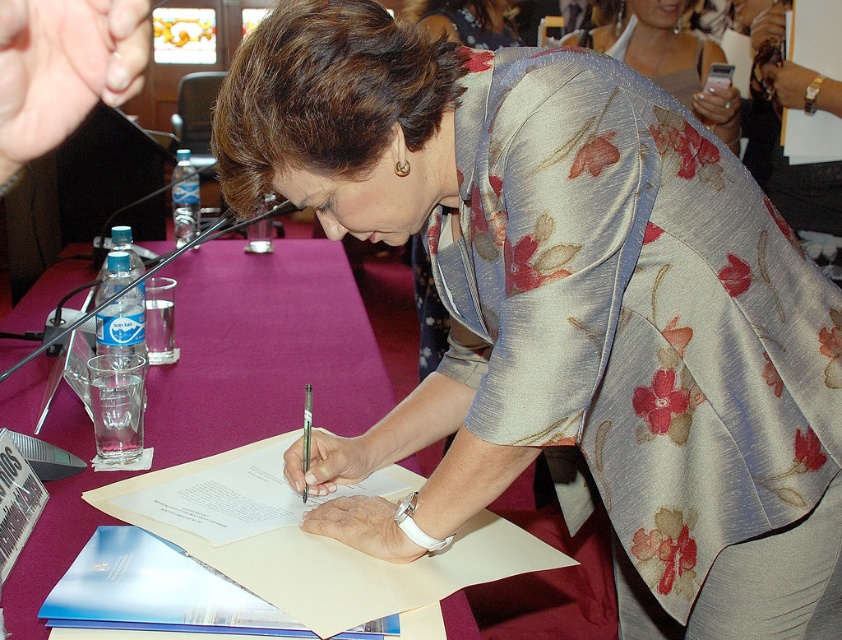
You are organizing a small event and need to place a 12x12 inch placemat on the purple fabric table at center. The white paper at center is currently on the table. Can the placemat fit on the table without overlapping the white paper?

The purple fabric table at center is larger in size than the white paper at center. Since the placemat is 12x12 inches, it depends on the exact dimensions of the table and the paper. However, since the table is larger than the paper, there might be enough space to place the placemat without overlapping, but this requires knowing the specific sizes of both the table and the paper.

Based on the scene described, where is the floral silk blouse at center in relation to the white paper at center?

The floral silk blouse at center is to the right of the white paper at center.

You are attending a formal event and need to place a name tag on the table. Given the items on the purple fabric table at center and the floral silk kimono at upper center, which one should you place it on?

The purple fabric table at center is located below the floral silk kimono at upper center, so the name tag should be placed on the purple fabric table at center since it is the table surface.